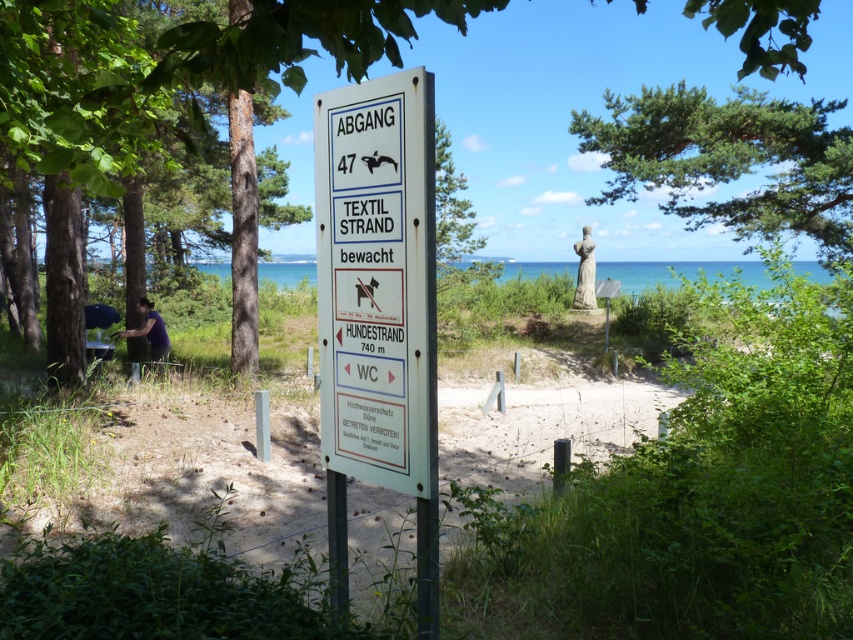
Between green leafy tree at upper center and green leafy tree at left, which one is positioned higher?

green leafy tree at upper center is higher up.

Based on the photo, can you confirm if green leafy tree at upper center is taller than green leafy tree at left?

Correct, green leafy tree at upper center is much taller as green leafy tree at left.

Does point (3, 136) lie behind point (117, 29)?

Yes, it is.

The image size is (853, 640). In order to click on green leafy tree at upper center in this screenshot , I will do `click(158, 108)`.

Looking at this image, is blue water at center above purple fabric shirt at lower left?

Yes.

Between blue water at center and purple fabric shirt at lower left, which one has less height?

purple fabric shirt at lower left is shorter.

Who is more forward, (287, 260) or (131, 337)?

Positioned in front is point (131, 337).

Where is `blue water at center`? blue water at center is located at coordinates (677, 272).

How far apart are white sand beach at center and purple fabric shirt at lower left?

6.31 meters

Which is behind, point (491, 440) or point (152, 310)?

Positioned behind is point (152, 310).

At what (x,y) coordinates should I click in order to perform the action: click on white sand beach at center. Please return your answer as a coordinate pair (x, y). The height and width of the screenshot is (640, 853). Looking at the image, I should click on (224, 472).